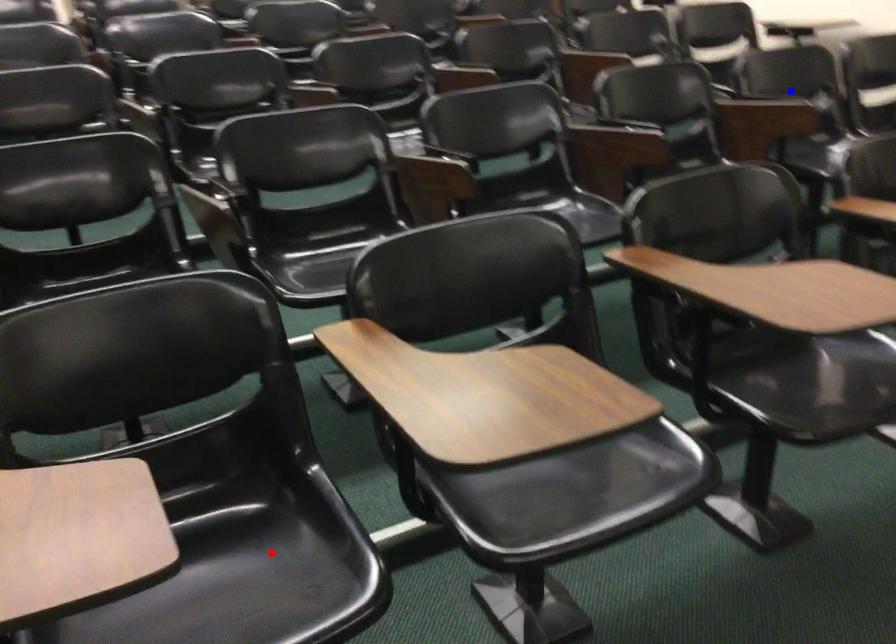
Question: Two points are marked on the image. Which point is closer to the camera?

Choices:
 (A) Blue point is closer.
 (B) Red point is closer.

Answer: (B)